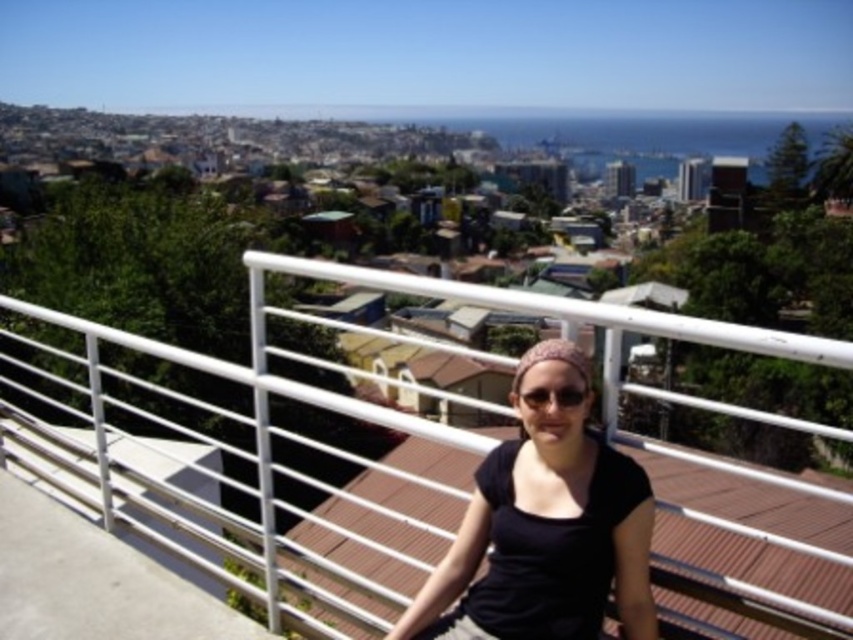
Question: Does black matte shirt at center appear over white metal railing at center?

Choices:
 (A) yes
 (B) no

Answer: (B)

Question: Does black matte shirt at center appear on the right side of white metal railing at center?

Choices:
 (A) yes
 (B) no

Answer: (A)

Question: Estimate the real-world distances between objects in this image. Which object is closer to the black plastic sunglasses at center?

Choices:
 (A) black matte shirt at center
 (B) white metal railing at center

Answer: (A)

Question: Among these objects, which one is farthest from the camera?

Choices:
 (A) black matte shirt at center
 (B) black plastic sunglasses at center

Answer: (B)

Question: Which point is farther to the camera?

Choices:
 (A) white metal railing at center
 (B) black matte shirt at center

Answer: (B)

Question: Is black matte shirt at center to the right of white metal railing at center from the viewer's perspective?

Choices:
 (A) yes
 (B) no

Answer: (A)